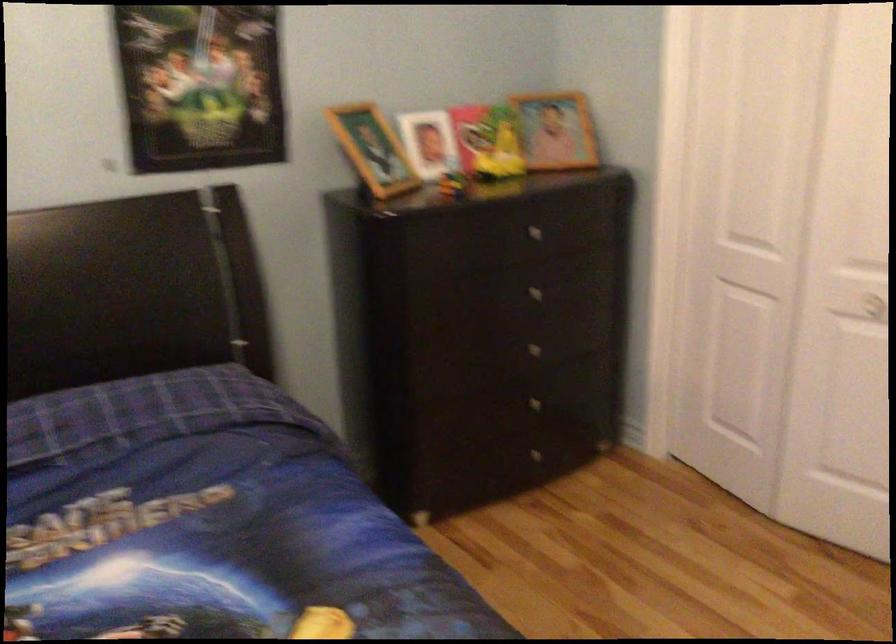
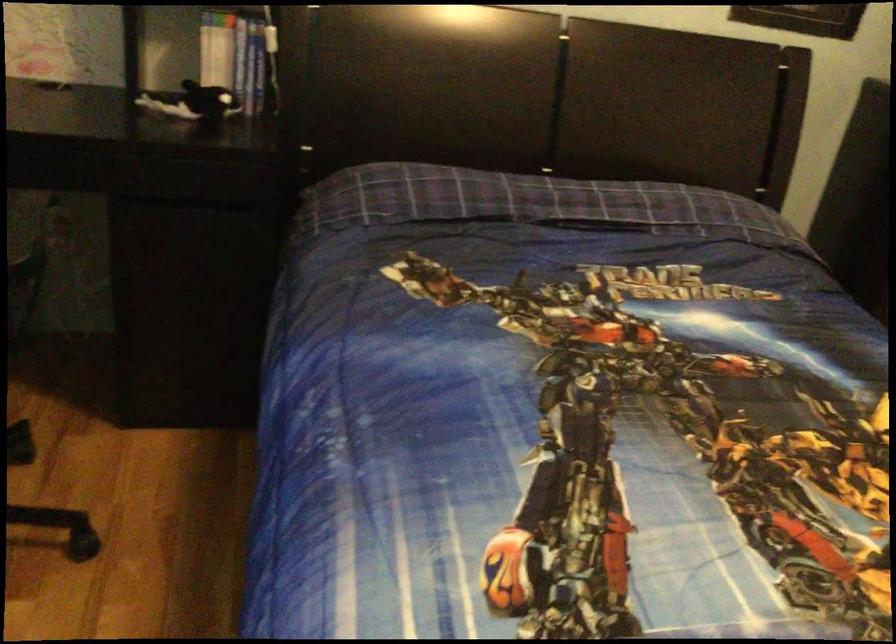
Question: The images are taken continuously from a first-person perspective. In which direction is your viewpoint rotating?

Choices:
 (A) Left
 (B) Right
 (C) Up
 (D) Down

Answer: (A)